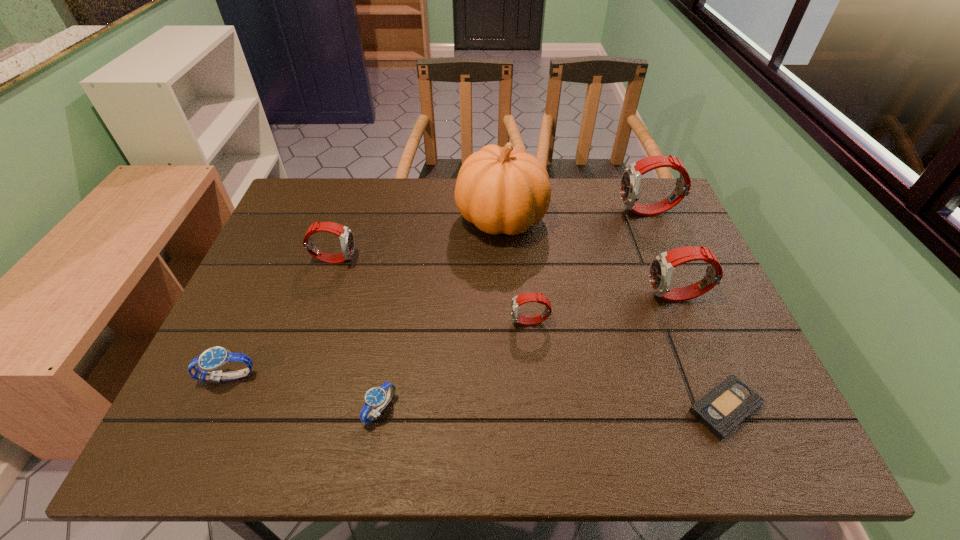
Find the location of a particular element. The image size is (960, 540). watch that is at the far edge is located at coordinates (631, 178).

I want to click on watch present at the near edge, so click(x=376, y=397).

I want to click on videotape positioned at the near edge, so click(721, 410).

Where is `videotape that is at the right edge`? The height and width of the screenshot is (540, 960). videotape that is at the right edge is located at coordinates (721, 410).

At what (x,y) coordinates should I click in order to perform the action: click on object at the far right corner. Please return your answer as a coordinate pair (x, y). Looking at the image, I should click on (631, 178).

Locate an element on the screen. object that is at the near right corner is located at coordinates (721, 410).

Identify the location of free space at the far edge. The image size is (960, 540). tap(391, 198).

The width and height of the screenshot is (960, 540). I want to click on free space at the near edge, so click(x=611, y=428).

Locate an element on the screen. The height and width of the screenshot is (540, 960). blank area at the left edge is located at coordinates (249, 282).

The width and height of the screenshot is (960, 540). What are the coordinates of `free space at the right edge of the desktop` in the screenshot? It's located at (655, 244).